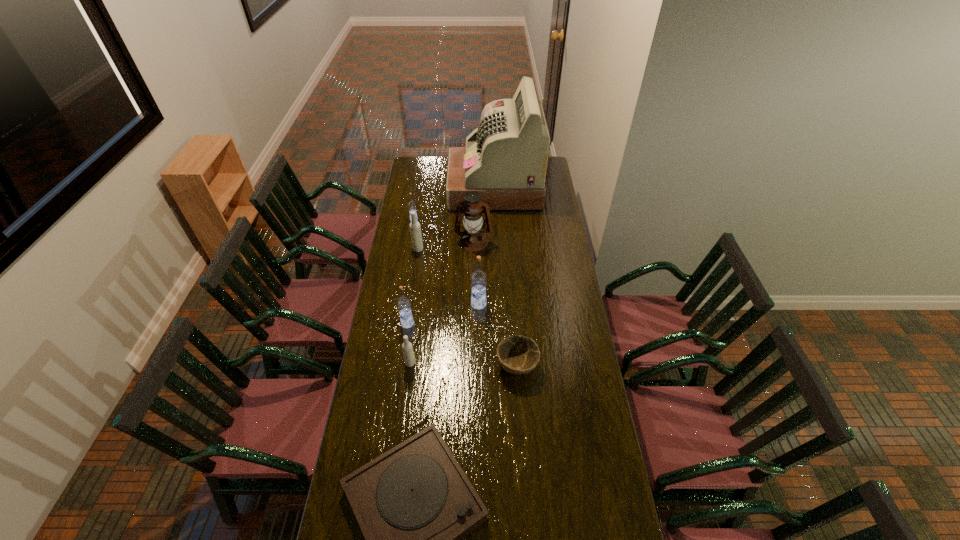
Locate which vodka is the second closest to the nearest vodka. Please provide its 2D coordinates. Your answer should be formatted as a tuple, i.e. [(x, y)], where the tuple contains the x and y coordinates of a point satisfying the conditions above.

[(478, 278)]

Image resolution: width=960 pixels, height=540 pixels. What are the coordinates of `the third closest blue vodka to the lantern` in the screenshot? It's located at (403, 303).

At what (x,y) coordinates should I click in order to perform the action: click on blue vodka that is the third closest to the shortest object. Please return your answer as a coordinate pair (x, y). The height and width of the screenshot is (540, 960). Looking at the image, I should click on (411, 205).

Find the location of `vacant area that satisfies the following two spatial constraints: 1. on the front side of the seventh shortest object; 2. on the right side of the farther white vodka`. vacant area that satisfies the following two spatial constraints: 1. on the front side of the seventh shortest object; 2. on the right side of the farther white vodka is located at coordinates (410, 304).

This screenshot has width=960, height=540. In order to click on vacant position in the image that satisfies the following two spatial constraints: 1. on the front side of the second smallest blue vodka; 2. on the right side of the farthest blue vodka in this screenshot , I will do pos(396,323).

This screenshot has width=960, height=540. I want to click on free space that satisfies the following two spatial constraints: 1. on the operating side of the farthest object; 2. on the front side of the fifth farthest object, so click(x=499, y=304).